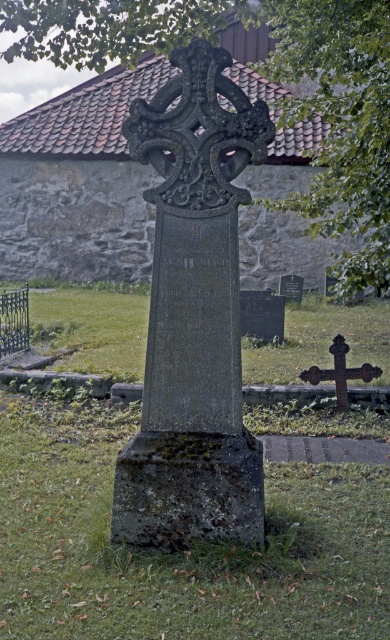
Question: Is green leafy tree at upper center further to the viewer compared to rusty metal cross at lower right?

Choices:
 (A) yes
 (B) no

Answer: (B)

Question: Can you confirm if green leafy tree at upper center is thinner than rusty metal cross at lower right?

Choices:
 (A) yes
 (B) no

Answer: (A)

Question: In this image, where is green leafy tree at upper center located relative to rusty metal cross at lower right?

Choices:
 (A) right
 (B) left

Answer: (B)